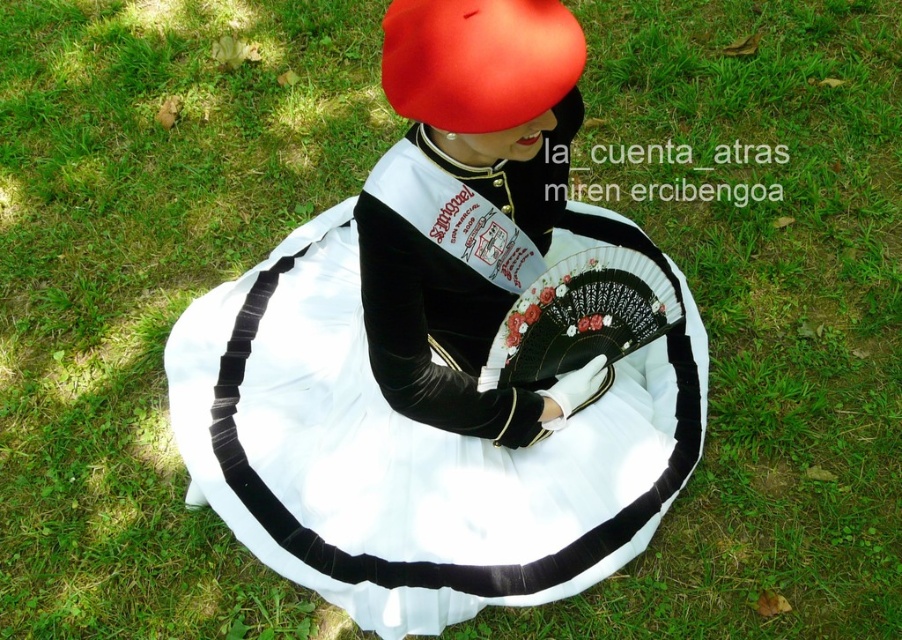
Question: Is white satin dress at center behind matte red hat at upper center?

Choices:
 (A) yes
 (B) no

Answer: (A)

Question: From the image, what is the correct spatial relationship of white satin dress at center in relation to matte red hat at upper center?

Choices:
 (A) left
 (B) right

Answer: (A)

Question: Which point is closer to the camera?

Choices:
 (A) matte red hat at upper center
 (B) white satin dress at center

Answer: (A)

Question: Which point is farther to the camera?

Choices:
 (A) [382, 464]
 (B) [434, 86]

Answer: (A)

Question: In this image, where is white satin dress at center located relative to matte red hat at upper center?

Choices:
 (A) below
 (B) above

Answer: (A)